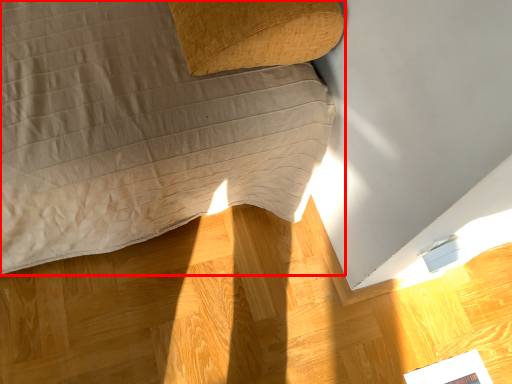
Question: From the image, what is the correct spatial relationship of furniture (annotated by the red box) in relation to magazine?

Choices:
 (A) left
 (B) right

Answer: (A)